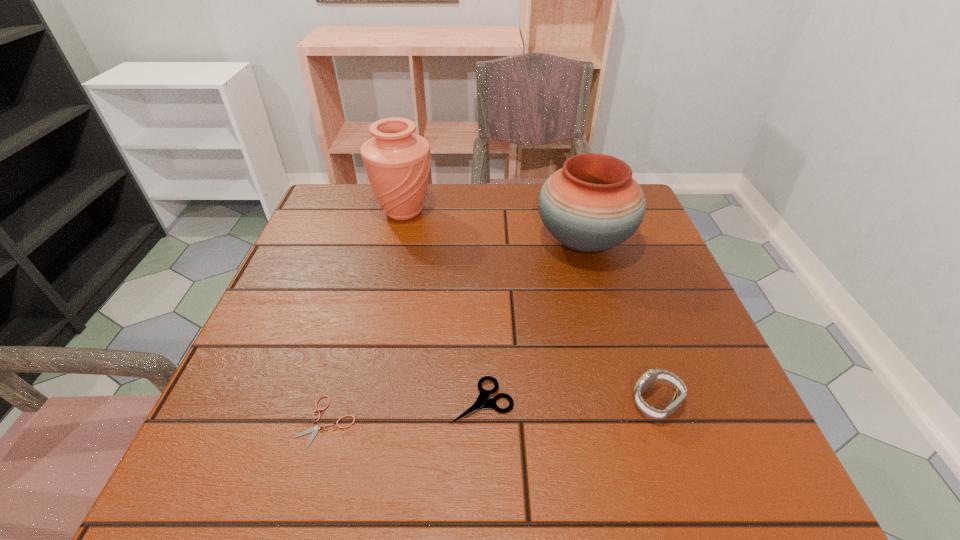
Locate an element on the screen. This screenshot has width=960, height=540. object that is the fourth closest to the vase is located at coordinates (651, 376).

Locate an element on the screen. The image size is (960, 540). vacant space that satisfies the following two spatial constraints: 1. on the back side of the taller shears; 2. on the right side of the pottery is located at coordinates (482, 242).

This screenshot has width=960, height=540. I want to click on vacant area that satisfies the following two spatial constraints: 1. on the front side of the taller shears; 2. on the left side of the vase, so click(x=360, y=401).